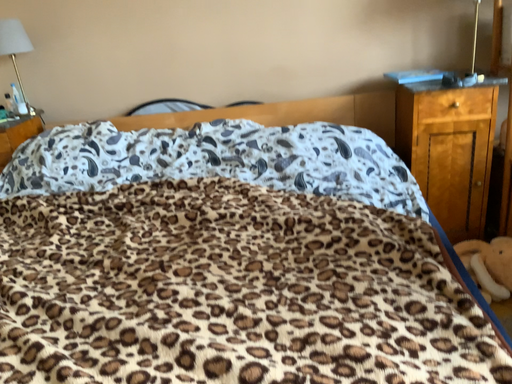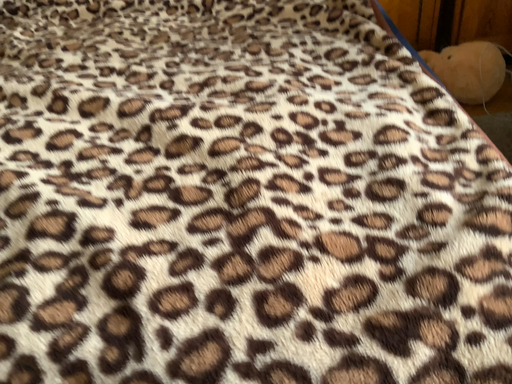
Question: How did the camera likely rotate when shooting the video?

Choices:
 (A) rotated upward
 (B) rotated downward

Answer: (B)